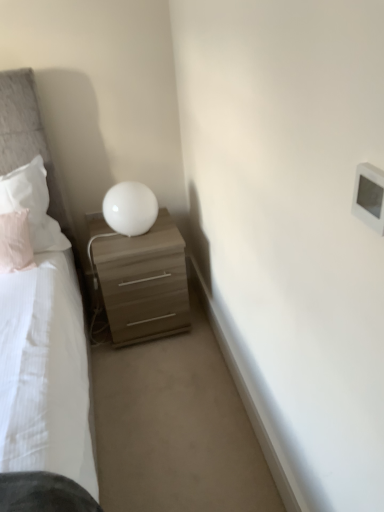
This screenshot has width=384, height=512. Find the location of `space that is in front of light brown wood nightstand at center`. space that is in front of light brown wood nightstand at center is located at coordinates (153, 377).